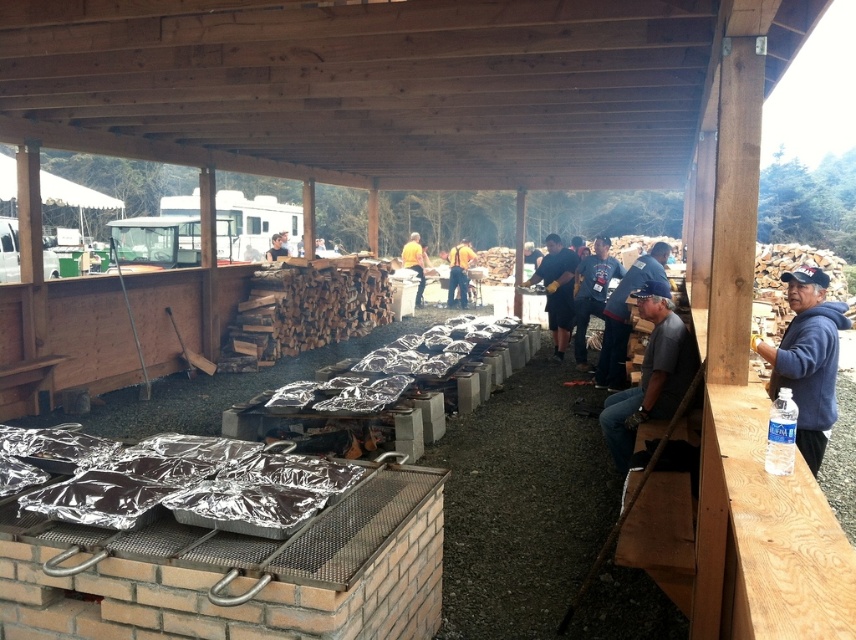
Question: Can you confirm if dark blue shirt at center is positioned below yellow fabric shirt at center?

Choices:
 (A) no
 (B) yes

Answer: (B)

Question: Which of these objects is positioned closest to the yellow fabric at center?

Choices:
 (A) yellow fabric shirt at center
 (B) gray fabric shirt at center

Answer: (A)

Question: Considering the relative positions of gray cotton shirt at center and dark gray cotton shirt at center in the image provided, where is gray cotton shirt at center located with respect to dark gray cotton shirt at center?

Choices:
 (A) left
 (B) right

Answer: (B)

Question: Among these objects, which one is farthest from the camera?

Choices:
 (A) yellow fabric shirt at center
 (B) dark gray cotton shirt at center
 (C) gray cotton shirt at center
 (D) yellow fabric at center

Answer: (A)

Question: Does dark blue shirt at center appear over yellow fabric at center?

Choices:
 (A) no
 (B) yes

Answer: (A)

Question: Based on their relative distances, which object is farther from the gray fabric shirt at center?

Choices:
 (A) dark blue shirt at center
 (B) yellow fabric at center
 (C) dark gray cotton shirt at center

Answer: (B)